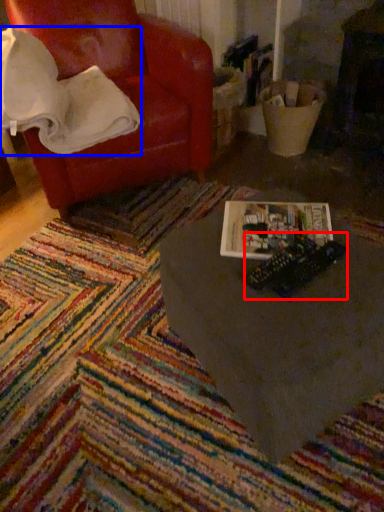
Question: Which point is further to the camera, toy (highlighted by a red box) or blanket (highlighted by a blue box)?

Choices:
 (A) toy
 (B) blanket

Answer: (B)